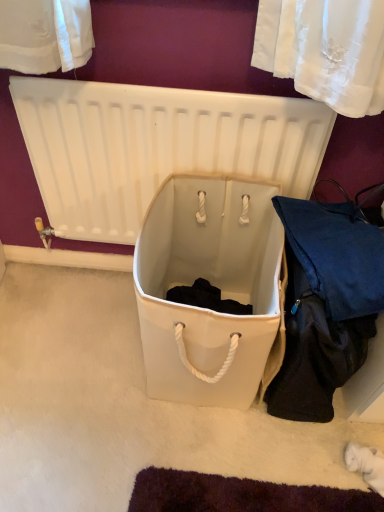
Question: Considering their positions, is dark blue fabric at lower right located in front of or behind white plastic radiator at center?

Choices:
 (A) front
 (B) behind

Answer: (A)

Question: In terms of height, does dark blue fabric at lower right look taller or shorter compared to white plastic radiator at center?

Choices:
 (A) tall
 (B) short

Answer: (B)

Question: Considering the real-world distances, which object is closest to the white plastic radiator at center?

Choices:
 (A) dark blue fabric at lower right
 (B) white fabric storage box at center

Answer: (B)

Question: Estimate the real-world distances between objects in this image. Which object is closer to the white fabric storage box at center?

Choices:
 (A) white plastic radiator at center
 (B) dark blue fabric at lower right

Answer: (B)